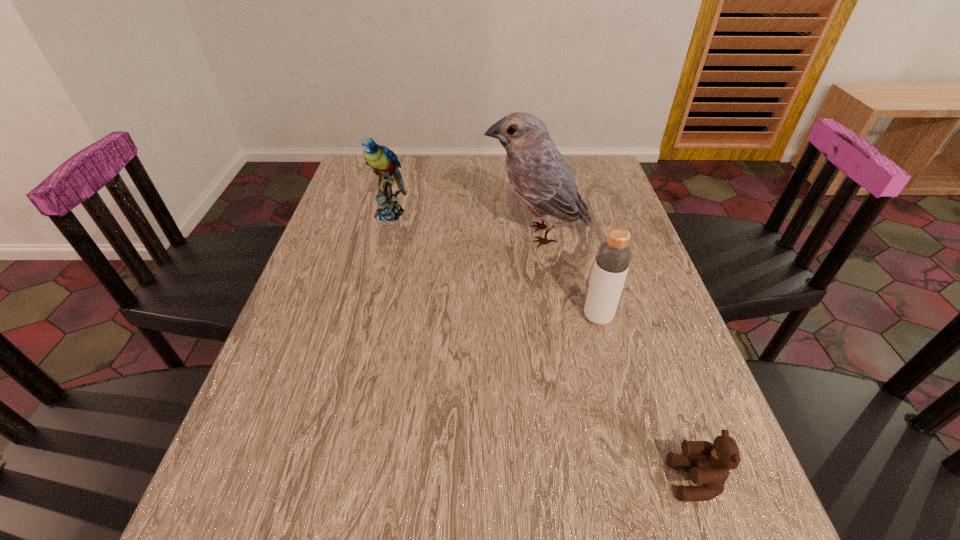
The width and height of the screenshot is (960, 540). In the image, there is a desktop. Identify the location of vacant space at the left edge. (342, 242).

In the image, there is a desktop. At what (x,y) coordinates should I click in order to perform the action: click on blank space at the right edge. Please return your answer as a coordinate pair (x, y). Looking at the image, I should click on (652, 324).

The height and width of the screenshot is (540, 960). In the image, there is a desktop. In order to click on vacant space at the far right corner in this screenshot , I will do `click(595, 156)`.

In order to click on vacant space at the near right corner of the desktop in this screenshot , I will do `click(758, 538)`.

Locate an element on the screen. vacant area that lies between the right parrot and the left parrot is located at coordinates click(464, 224).

The image size is (960, 540). Find the location of `vacant region between the right parrot and the left parrot`. vacant region between the right parrot and the left parrot is located at coordinates (464, 224).

This screenshot has height=540, width=960. I want to click on vacant space that is in between the second nearest object and the right parrot, so click(567, 276).

In order to click on vacant space in between the shorter parrot and the bottle in this screenshot , I will do `click(493, 265)`.

The height and width of the screenshot is (540, 960). I want to click on vacant point located between the left parrot and the nearest object, so click(542, 347).

Locate an element on the screen. vacant region between the leftmost object and the bottle is located at coordinates (493, 265).